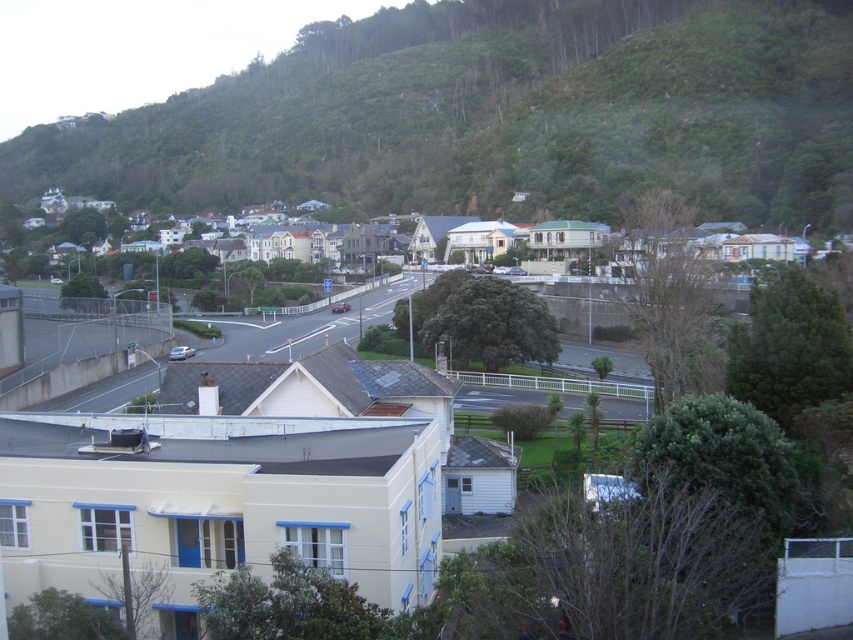
You are a drone operator trying to capture aerial footage of the suburban area. You need to fly your drone from the green leafy hillside at upper center to the white painted houses at center. Based on the scene description, will the drone have to descend in altitude to reach the houses?

The green leafy hillside at upper center is taller than the white painted houses at center, so the drone will have to descend in altitude to reach the white painted houses at center from the hillside.

You are standing at the point closer to the viewer in the suburban area. Which point are you at, point (846,118) or point (4,268)?

You are at point (846,118) because it is further to the viewer than point (4,268).